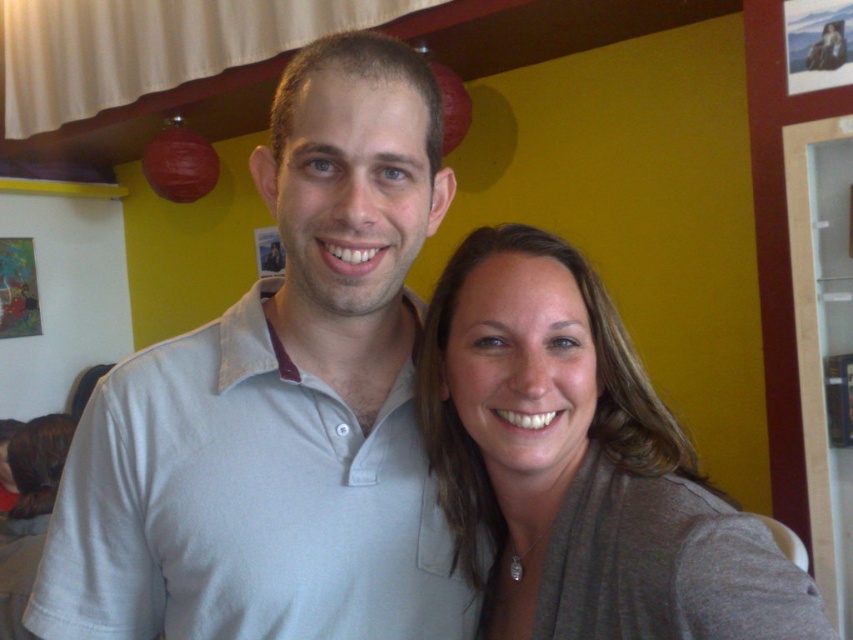
Question: Which of the following is the closest to the observer?

Choices:
 (A) light gray cotton polo shirt at center
 (B) matte gray scarf at right

Answer: (B)

Question: Is light gray cotton polo shirt at center positioned in front of matte gray scarf at right?

Choices:
 (A) no
 (B) yes

Answer: (A)

Question: Can you confirm if light gray cotton polo shirt at center is thinner than matte gray scarf at right?

Choices:
 (A) yes
 (B) no

Answer: (B)

Question: Does light gray cotton polo shirt at center appear under matte gray scarf at right?

Choices:
 (A) yes
 (B) no

Answer: (B)